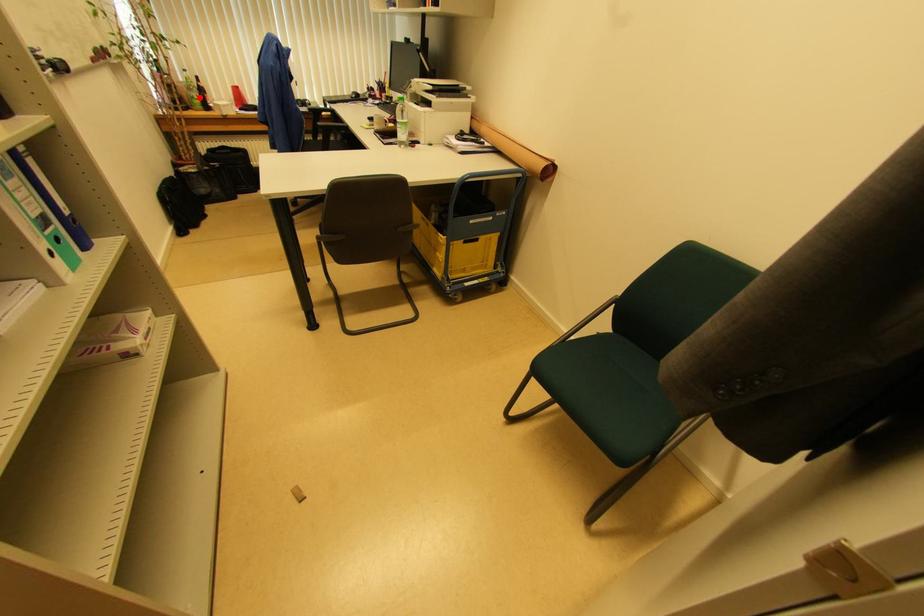
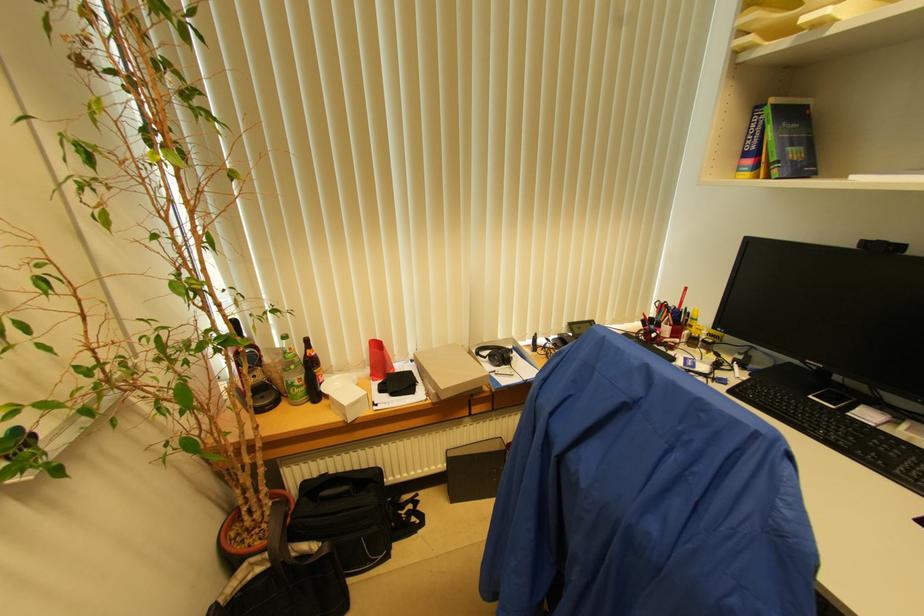
Question: I am providing you with two images of the same scene from different viewpoints. Given a red point in image1, look at the same physical point in image2. Is it:

Choices:
 (A) Closer to the viewpoint
 (B) Farther from the viewpoint

Answer: (A)